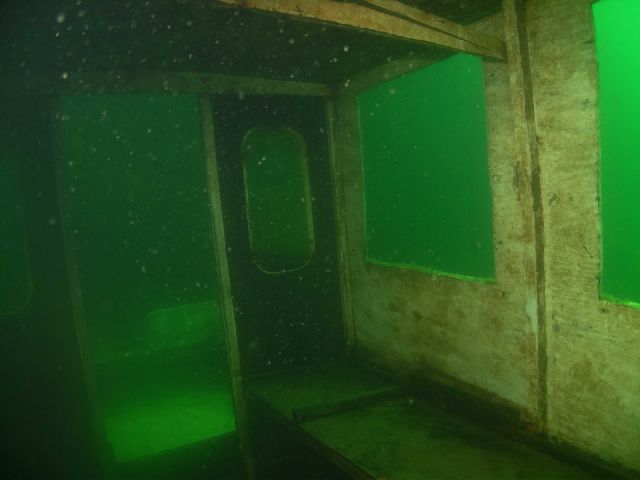
Locate an element on the screen. This screenshot has width=640, height=480. ceiling bars is located at coordinates (364, 16).